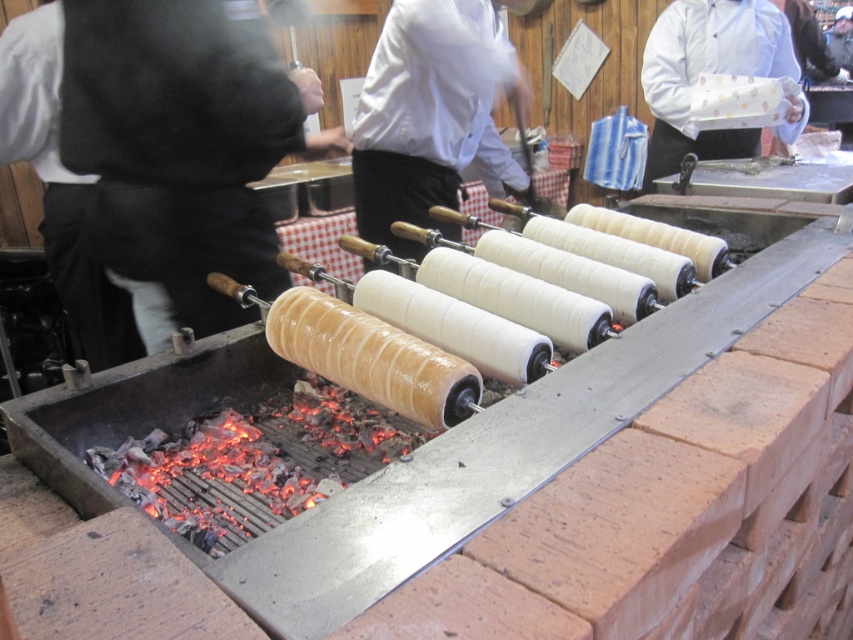
Question: Which point appears farthest from the camera in this image?

Choices:
 (A) (357, 451)
 (B) (442, 164)

Answer: (B)

Question: Which point is closer to the camera?

Choices:
 (A) white glossy chef coat at center
 (B) charcoal-cooked dough at center

Answer: (B)

Question: Is white glossy chef coat at center smaller than charcoal-cooked dough at center?

Choices:
 (A) no
 (B) yes

Answer: (A)

Question: Which point appears closest to the camera in this image?

Choices:
 (A) (396, 186)
 (B) (215, 502)

Answer: (B)

Question: Can you confirm if white glossy chef coat at center is positioned below charcoal-cooked dough at center?

Choices:
 (A) no
 (B) yes

Answer: (A)

Question: Can you confirm if white glossy chef coat at center is positioned to the left of charcoal-cooked dough at center?

Choices:
 (A) no
 (B) yes

Answer: (A)